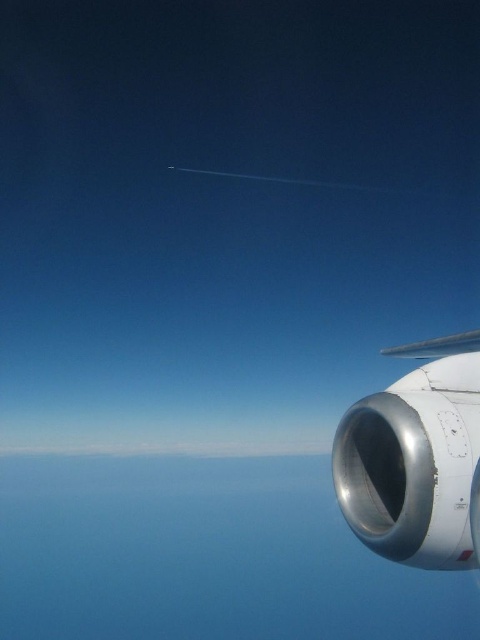
You are a pilot looking at the aircraft engine from inside the cockpit. Where is the metallic jet engine at right located in terms of its coordinates?

The metallic jet engine at right is located at coordinates point (417, 460).

You are a flight attendant who needs to move from the cockpit to the galley located behind the metallic jet engine at right. The distance between them is 3.17 meters. Can you carry a 1.5 meter long ladder horizontally through this space?

The distance between the cockpit and the galley is 3.17 meters. Since the ladder is 1.5 meters long, you can carry it horizontally as the space is wider than the ladder.

You are a flight attendant checking the aircraft components. You need to determine if the metallic jet engine at right has a larger width compared to the silver metallic wing at upper right. Based on the provided information, can you confirm this?

The metallic jet engine at right might be wider than silver metallic wing at upper right according to the description, so it is possible that the metallic jet engine at right has a larger width than the silver metallic wing at upper right.